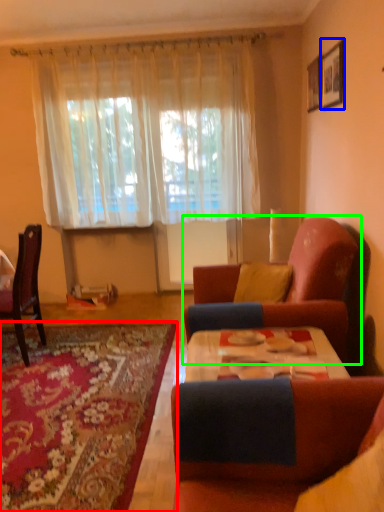
Question: Considering the real-world distances, which object is farthest from mat (highlighted by a red box)? picture frame (highlighted by a blue box) or studio couch (highlighted by a green box)?

Choices:
 (A) picture frame
 (B) studio couch

Answer: (A)